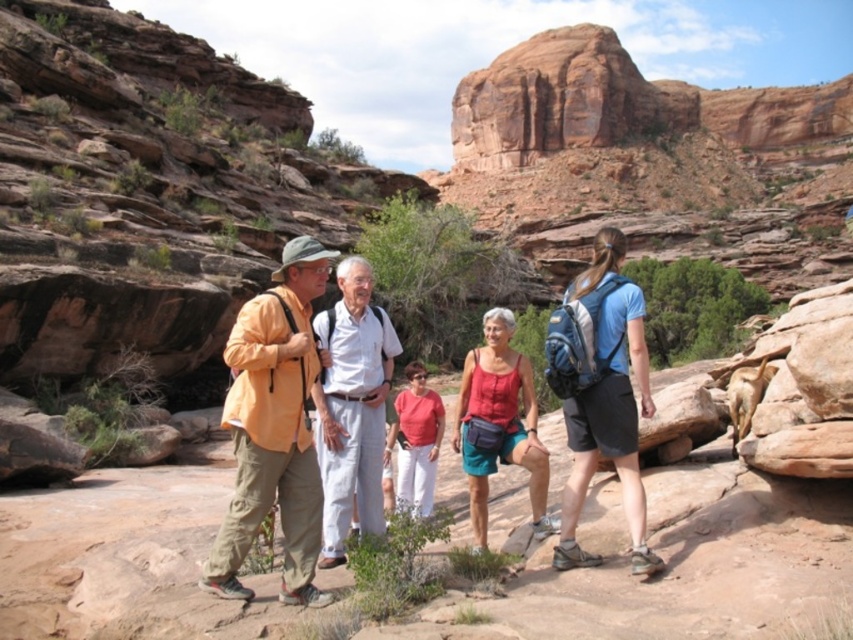
Question: Which of the following is the closest to the observer?

Choices:
 (A) light beige cotton shirt at center
 (B) reddish-brown rock formation at upper center
 (C) orange fabric jacket at center

Answer: (C)

Question: Which object is farther from the camera taking this photo?

Choices:
 (A) orange fabric jacket at center
 (B) reddish-brown rock formation at upper center

Answer: (B)

Question: Does orange fabric jacket at center appear over blue fabric backpack at center-right?

Choices:
 (A) no
 (B) yes

Answer: (B)

Question: Does orange fabric jacket at center appear on the left side of blue fabric backpack at center-right?

Choices:
 (A) yes
 (B) no

Answer: (A)

Question: Does reddish-brown rock formation at upper center have a lesser width compared to blue fabric backpack at center-right?

Choices:
 (A) yes
 (B) no

Answer: (B)

Question: Which point appears closest to the camera in this image?

Choices:
 (A) (312, 324)
 (B) (643, 113)

Answer: (A)